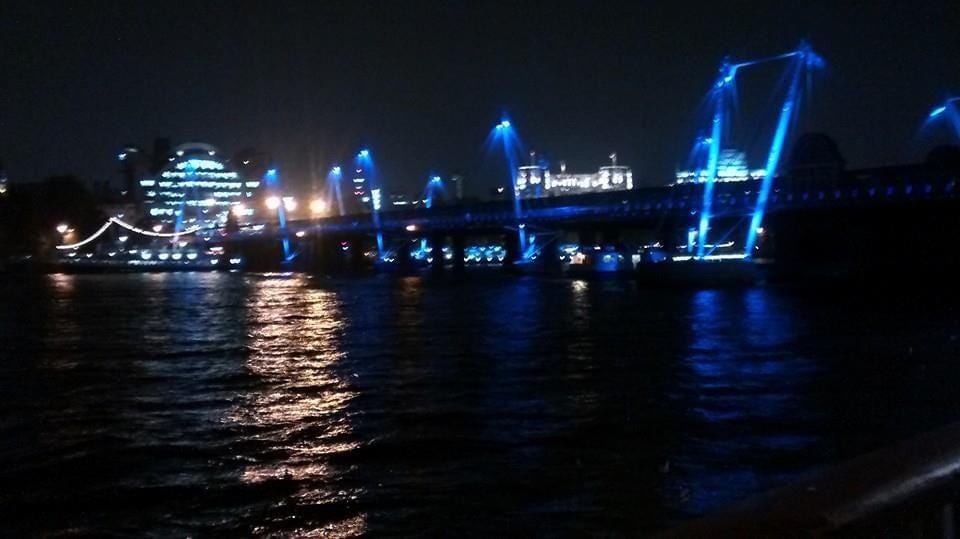
Locate an element on the screen. The image size is (960, 539). spot light is located at coordinates (792, 87).